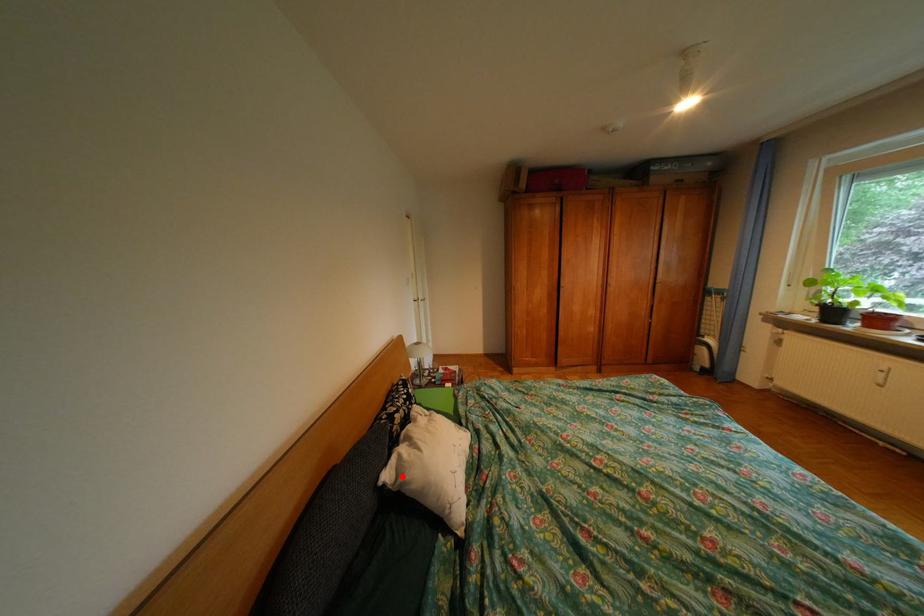
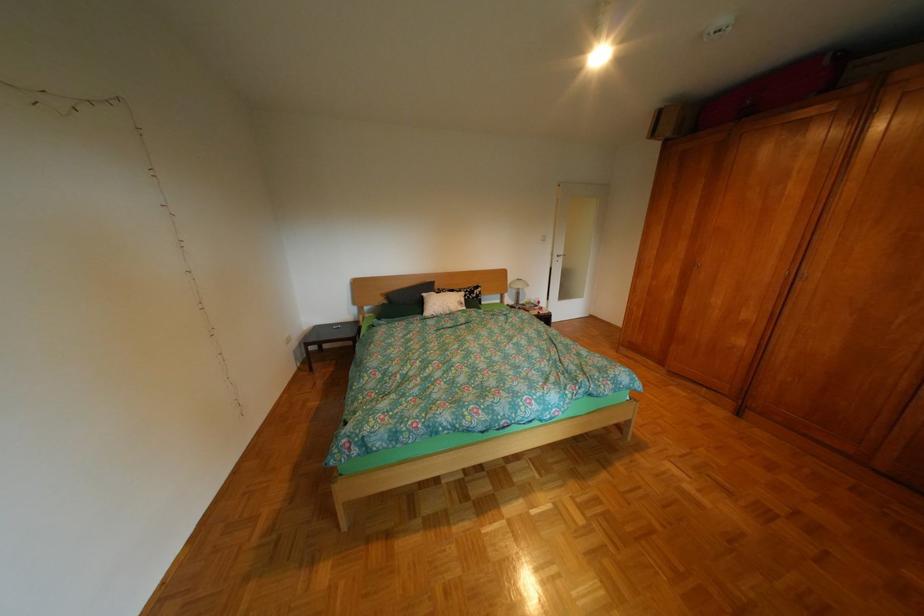
In the second image, find the point that corresponds to the highlighted location in the first image.

(439, 294)